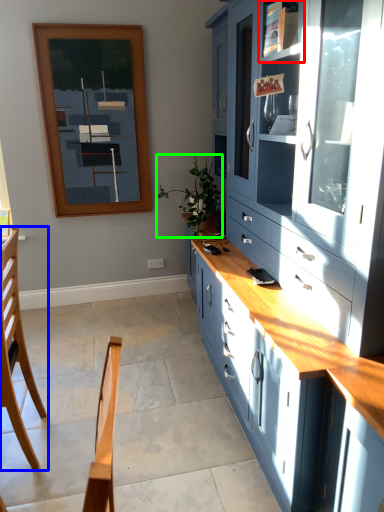
Question: Based on their relative distances, which object is farther from shelf (highlighted by a red box)? Choose from chair (highlighted by a blue box) and plant (highlighted by a green box).

Choices:
 (A) chair
 (B) plant

Answer: (A)